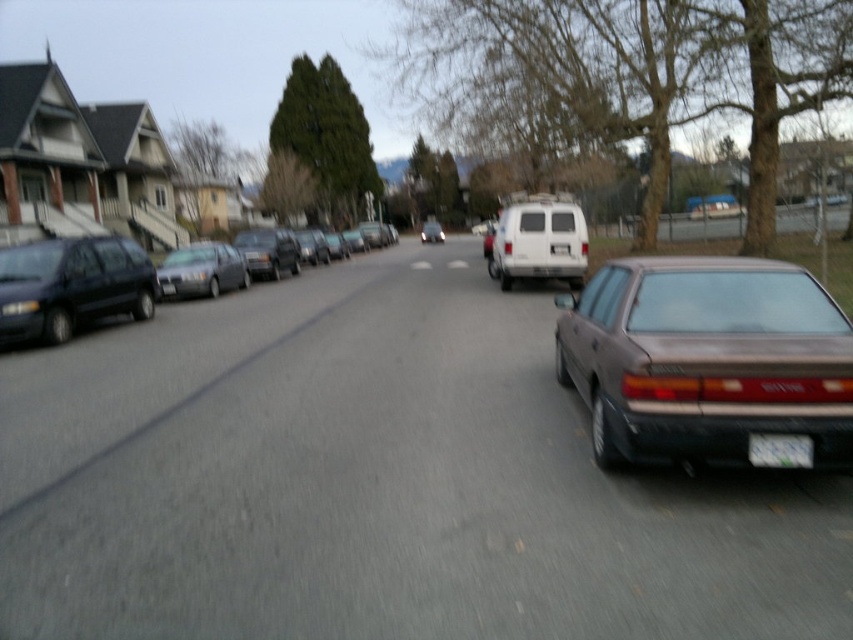
Who is positioned more to the right, brown matte sedan at center or satin silver sedan at left?

brown matte sedan at center

Describe the element at coordinates (706, 358) in the screenshot. The width and height of the screenshot is (853, 640). I see `brown matte sedan at center` at that location.

Where is `brown matte sedan at center`? The width and height of the screenshot is (853, 640). brown matte sedan at center is located at coordinates (706, 358).

In the scene shown: Is brown matte sedan at center above matte gray suv at center?

Actually, brown matte sedan at center is below matte gray suv at center.

Can you confirm if brown matte sedan at center is wider than matte gray suv at center?

No.

This screenshot has height=640, width=853. What do you see at coordinates (706, 358) in the screenshot?
I see `brown matte sedan at center` at bounding box center [706, 358].

Locate an element on the screen. Image resolution: width=853 pixels, height=640 pixels. brown matte sedan at center is located at coordinates (706, 358).

Is point (9, 317) positioned in front of point (271, 262)?

Yes, point (9, 317) is in front of point (271, 262).

Can you confirm if matte black minivan at left is shorter than matte gray suv at center?

Correct, matte black minivan at left is not as tall as matte gray suv at center.

Find the location of a particular element. This screenshot has width=853, height=640. matte black minivan at left is located at coordinates (71, 285).